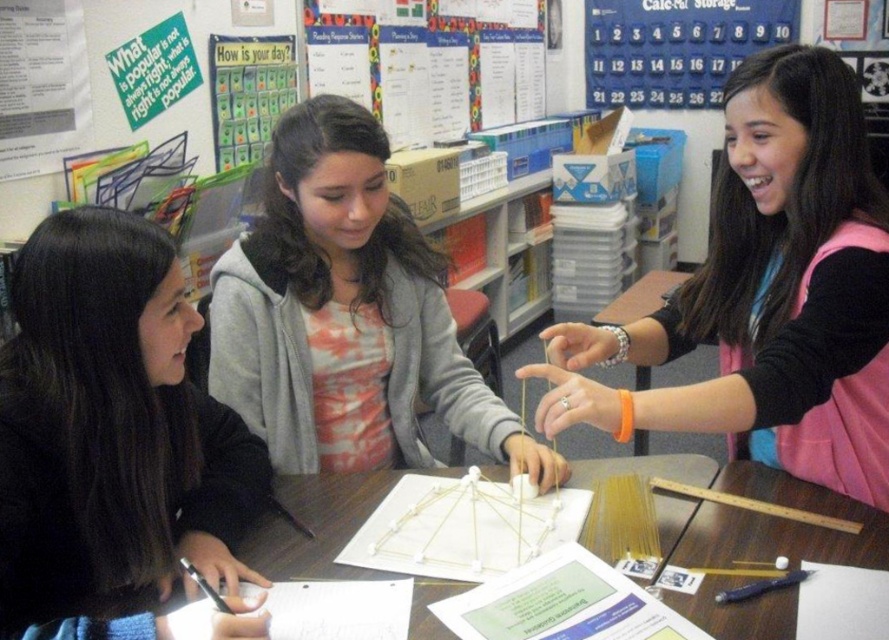
Question: Does wooden table at center appear on the right side of white paperboard at upper center?

Choices:
 (A) no
 (B) yes

Answer: (B)

Question: Which point appears farthest from the camera in this image?

Choices:
 (A) (453, 77)
 (B) (810, 88)
 (C) (90, 472)

Answer: (A)

Question: Can you confirm if gray hoodie at center is positioned below white paperboard at upper center?

Choices:
 (A) yes
 (B) no

Answer: (A)

Question: Which object appears farthest from the camera in this image?

Choices:
 (A) black matte jacket at left
 (B) orange wristband at upper right

Answer: (B)

Question: Can you confirm if orange wristband at upper right is thinner than white paperboard at upper center?

Choices:
 (A) yes
 (B) no

Answer: (A)

Question: Which object appears closest to the camera in this image?

Choices:
 (A) gray hoodie at center
 (B) wooden table at center

Answer: (B)